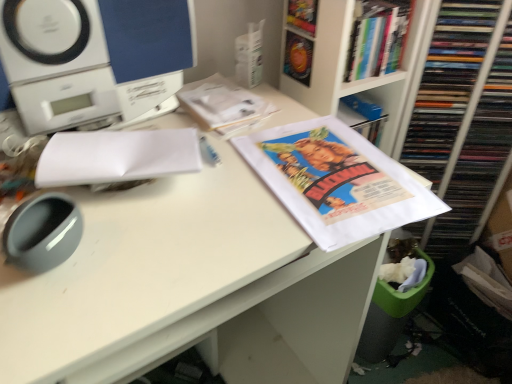
Find the location of a particular element. vacant space in front of white paper at upper center, marked as the second book in a top-to-bottom arrangement is located at coordinates (223, 159).